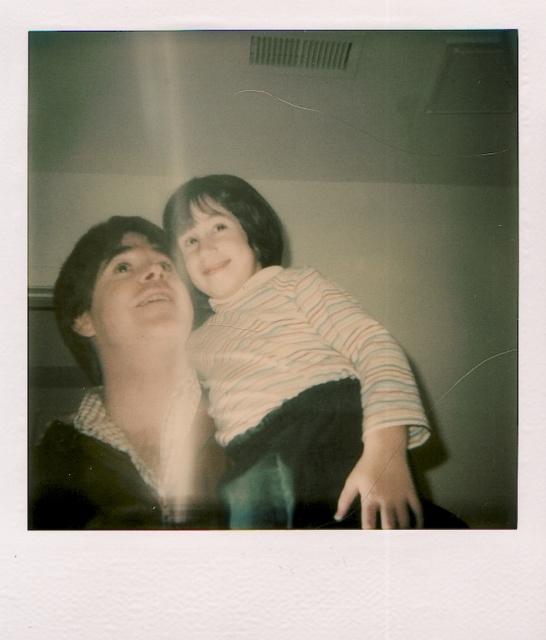
Question: Does striped fabric shirt at center have a greater width compared to matte black shirt at center?

Choices:
 (A) yes
 (B) no

Answer: (A)

Question: Which point is farther to the camera?

Choices:
 (A) striped fabric shirt at center
 (B) matte black shirt at center

Answer: (B)

Question: Which of the following is the farthest from the observer?

Choices:
 (A) (240, 525)
 (B) (72, 288)

Answer: (B)

Question: Which point is closer to the camera taking this photo?

Choices:
 (A) (399, 472)
 (B) (124, 378)

Answer: (A)

Question: Can you confirm if striped fabric shirt at center is positioned above matte black shirt at center?

Choices:
 (A) no
 (B) yes

Answer: (B)

Question: Is striped fabric shirt at center further to the viewer compared to matte black shirt at center?

Choices:
 (A) no
 (B) yes

Answer: (A)